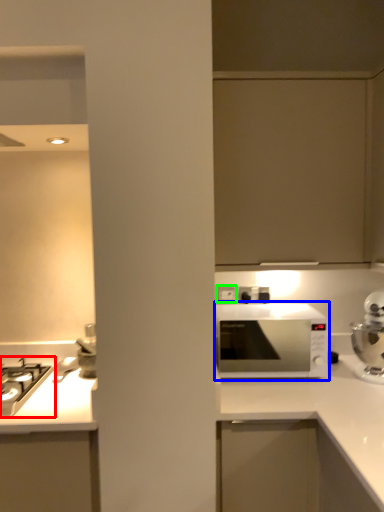
Question: Which object is the farthest from gas stove (highlighted by a red box)? Choose among these: microwave oven (highlighted by a blue box) or electric outlet (highlighted by a green box).

Choices:
 (A) microwave oven
 (B) electric outlet

Answer: (A)